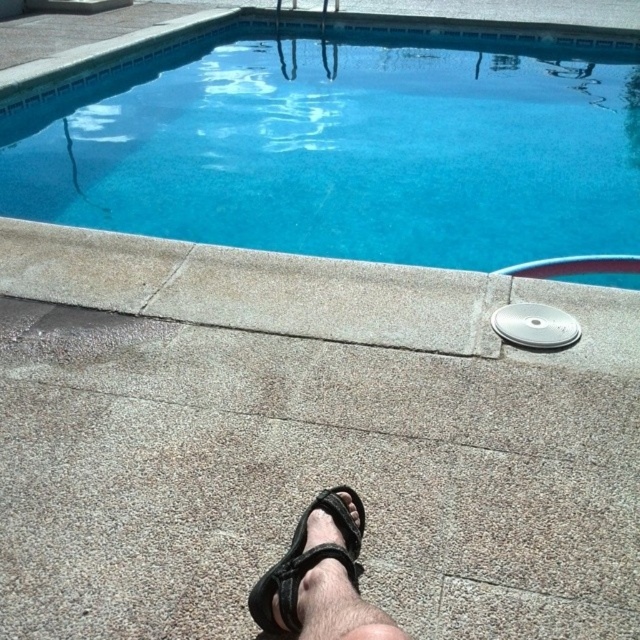
Question: Is blue concrete swimming pool at upper center to the left of black fabric sandal at lower center from the viewer's perspective?

Choices:
 (A) no
 (B) yes

Answer: (A)

Question: Does blue concrete swimming pool at upper center appear over black fabric sandal at lower center?

Choices:
 (A) yes
 (B) no

Answer: (A)

Question: Which object appears closest to the camera in this image?

Choices:
 (A) blue concrete swimming pool at upper center
 (B) black fabric sandal at lower center

Answer: (B)

Question: Which point appears closest to the camera in this image?

Choices:
 (A) (433, 152)
 (B) (269, 593)

Answer: (B)

Question: Does blue concrete swimming pool at upper center have a larger size compared to black fabric sandal at lower center?

Choices:
 (A) no
 (B) yes

Answer: (B)